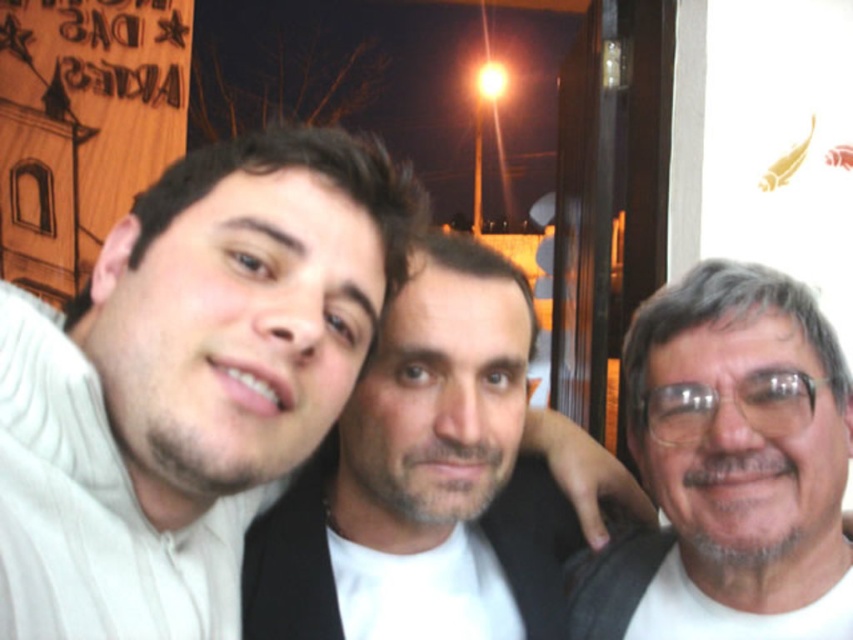
Does smooth skin face at center have a smaller size compared to white matte glasses at right?

Incorrect, smooth skin face at center is not smaller in size than white matte glasses at right.

Who is lower down, smooth skin face at center or white matte glasses at right?

Positioned lower is smooth skin face at center.

Does point (325, 465) lie behind point (697, 276)?

Yes.

You are a GUI agent. You are given a task and a screenshot of the screen. Output one action in this format:
    pyautogui.click(x=<x>, y=<y>)
    Task: Click on the smooth skin face at center
    
    Given the screenshot: What is the action you would take?
    pyautogui.click(x=436, y=480)

Can you confirm if white matte sweater at left is bigger than transparent plastic glasses at right?

Yes, white matte sweater at left is bigger than transparent plastic glasses at right.

Which is behind, point (175, 556) or point (708, 400)?

Positioned behind is point (708, 400).

Where is `white matte sweater at left`? The height and width of the screenshot is (640, 853). white matte sweater at left is located at coordinates (187, 381).

Can you confirm if white matte glasses at right is smaller than transparent plastic glasses at right?

No, white matte glasses at right is not smaller than transparent plastic glasses at right.

Does white matte glasses at right have a greater height compared to transparent plastic glasses at right?

Correct, white matte glasses at right is much taller as transparent plastic glasses at right.

I want to click on white matte glasses at right, so click(x=730, y=468).

Find the location of `white matte glasses at right`. white matte glasses at right is located at coordinates (730, 468).